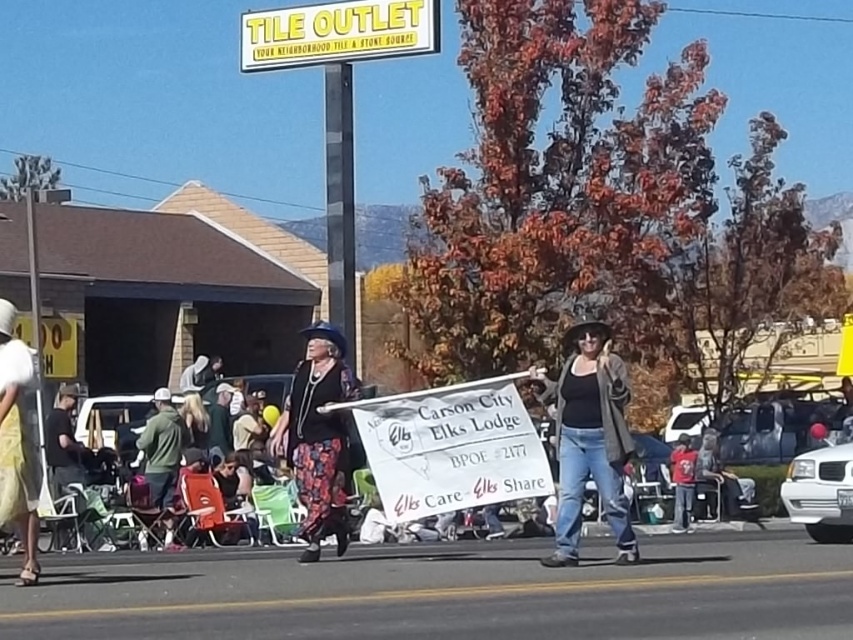
You are a photographer trying to capture the banner and both individuals in the scene. The black matte jacket at center and yellow fabric skirt at lower left are important subjects. Based on their positions, which object is closer to the camera?

The yellow fabric skirt at lower left is closer to the camera because the black matte jacket at center is located below it, indicating it is further away.